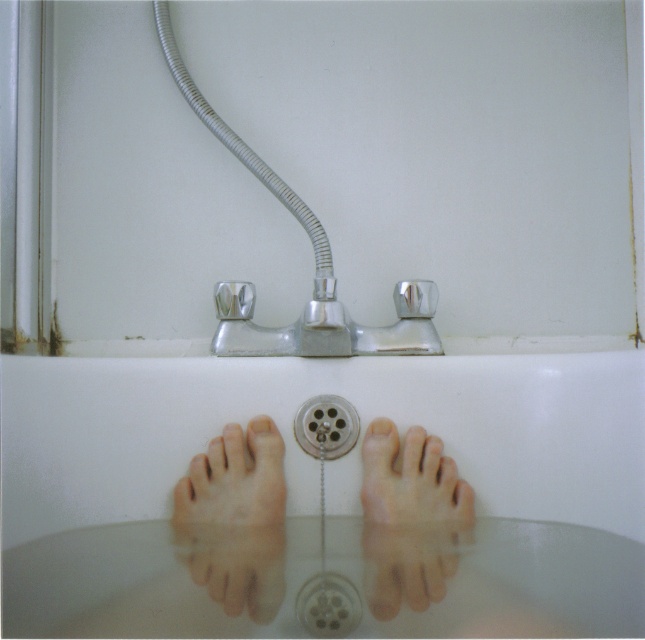
You are standing in the bathroom and see the chrome metallic shower head at upper center and the pink flesh toe at center. Which object is higher in the image?

The chrome metallic shower head at upper center is higher than the pink flesh toe at center.

You are a foot care specialist examining the feet submerged in the bathtub. You need to apply a moisturizer to both the pale skin toe at center and the pink flesh toe at center. If your moisturizer tube can only reach 15 centimeters, will you be able to reach both toes without moving your hand?

The pale skin toe at center is 17.25 centimeters from the pink flesh toe at center. Since the moisturizer tube can only reach 15 centimeters, you will not be able to reach both toes without moving your hand.